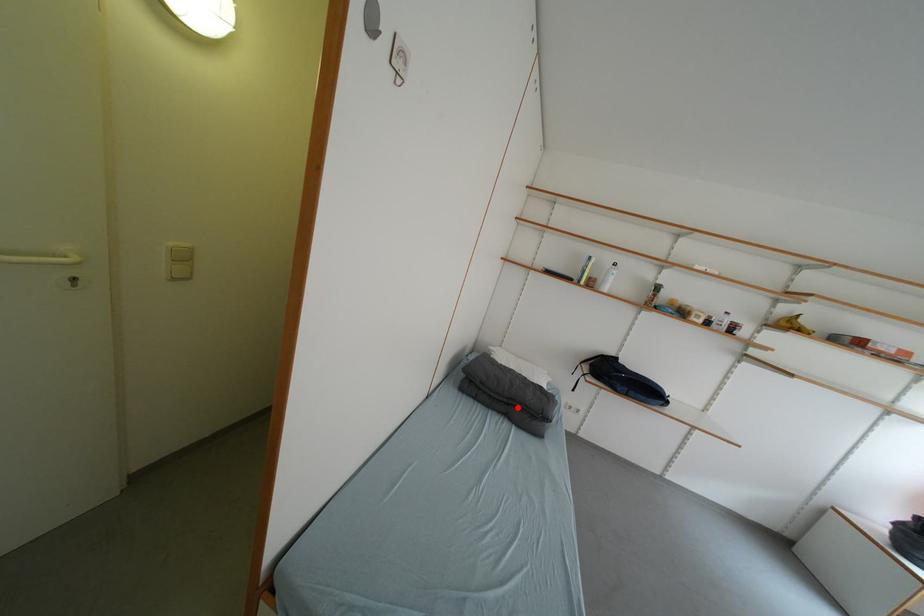
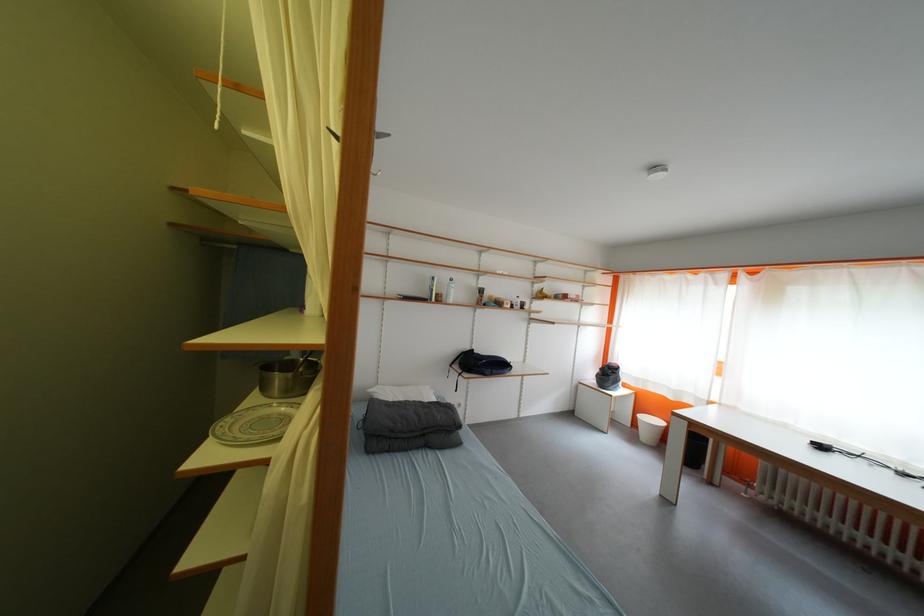
In the second image, find the point that corresponds to the highlighted location in the first image.

(432, 438)